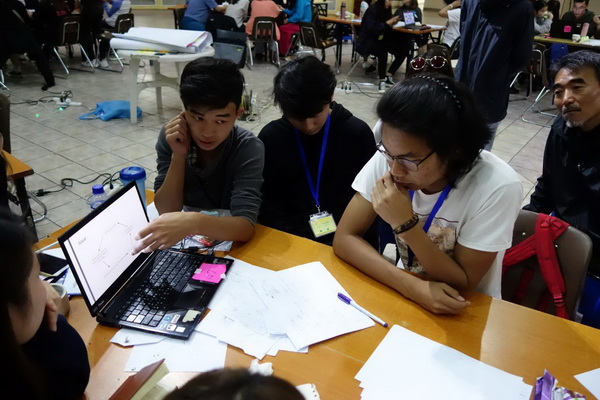
Identify the location of laptop. [x=114, y=248].